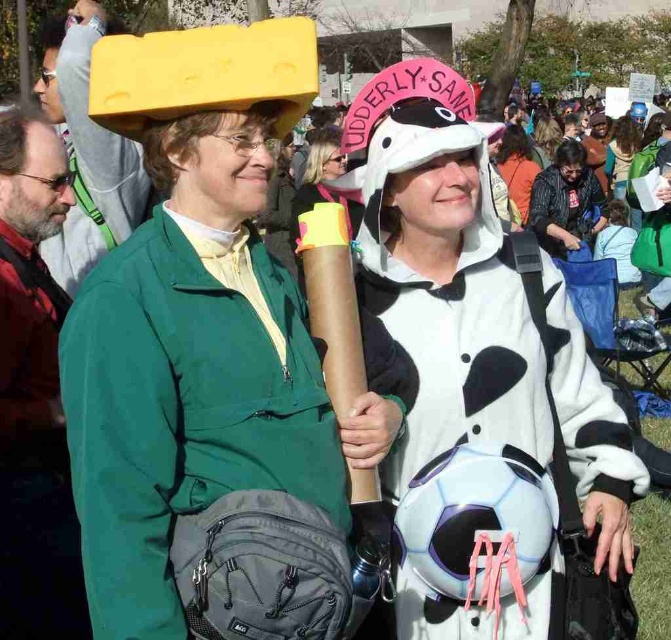
Question: Considering the relative positions of white fuzzy onesie at center and matte black backpack at center in the image provided, where is white fuzzy onesie at center located with respect to matte black backpack at center?

Choices:
 (A) below
 (B) above

Answer: (A)

Question: Which is nearer to the black striped shirt at center?

Choices:
 (A) matte black backpack at center
 (B) green matte jacket at upper left

Answer: (A)

Question: Among these objects, which one is nearest to the camera?

Choices:
 (A) white fuzzy onesie at center
 (B) matte black jacket at left
 (C) white plush hat at center

Answer: (A)

Question: In this image, where is matte black jacket at left located relative to matte black backpack at center?

Choices:
 (A) above
 (B) below

Answer: (B)

Question: Among these points, which one is nearest to the camera?

Choices:
 (A) (519, 173)
 (B) (537, 156)

Answer: (A)

Question: Does matte black jacket at left appear over matte black soccer ball at center?

Choices:
 (A) yes
 (B) no

Answer: (B)